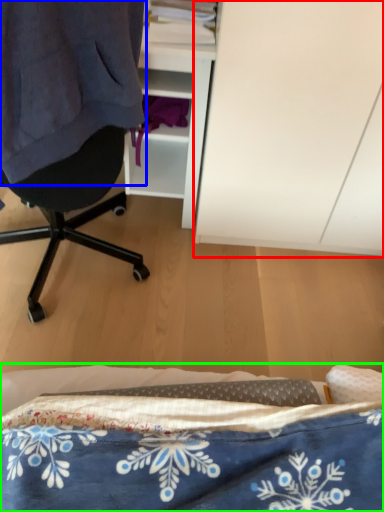
Question: Estimate the real-world distances between objects in this image. Which object is closer to cabinetry (highlighted by a red box), clothing (highlighted by a blue box) or bed (highlighted by a green box)?

Choices:
 (A) clothing
 (B) bed

Answer: (A)